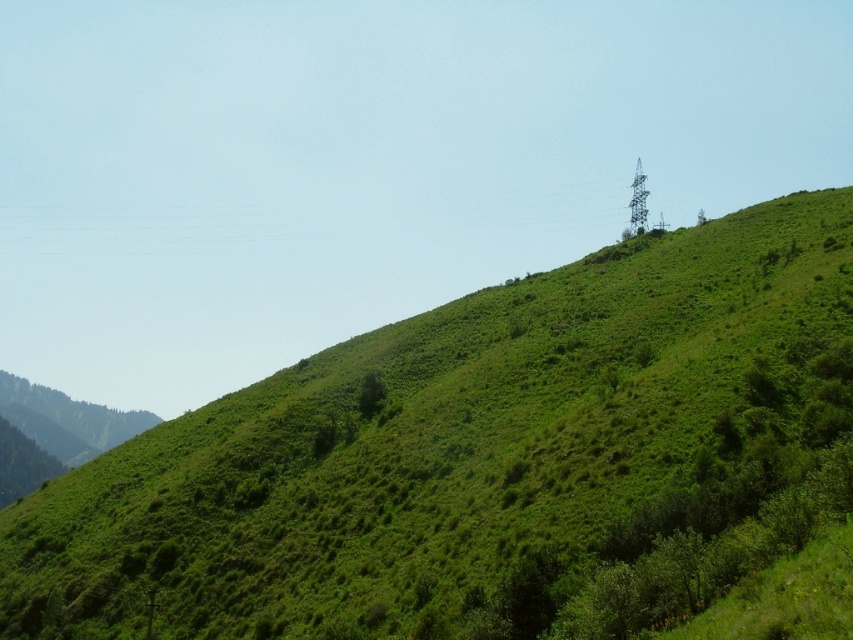
Looking at this image, between green leafy tree at lower left and green leafy tree at center, which one appears on the right side from the viewer's perspective?

Positioned to the right is green leafy tree at center.

Is green leafy tree at lower left to the right of green leafy tree at center from the viewer's perspective?

No, green leafy tree at lower left is not to the right of green leafy tree at center.

What do you see at coordinates (22, 464) in the screenshot? This screenshot has width=853, height=640. I see `green leafy tree at lower left` at bounding box center [22, 464].

Identify the location of green leafy tree at lower left. The width and height of the screenshot is (853, 640). (22, 464).

In the scene shown: Does green grassy hill at upper center have a lesser width compared to green leafy tree at center?

No, green grassy hill at upper center is not thinner than green leafy tree at center.

Is green grassy hill at upper center bigger than green leafy tree at center?

Yes.

Find the location of a particular element. green grassy hill at upper center is located at coordinates (465, 449).

The height and width of the screenshot is (640, 853). Identify the location of green grassy hill at upper center. (465, 449).

Who is positioned more to the right, green grassy hill at upper center or green leafy tree at lower left?

Positioned to the right is green grassy hill at upper center.

Is point (68, 618) farther from viewer compared to point (38, 477)?

No, (68, 618) is closer to viewer.

Is point (526, 493) positioned before point (28, 454)?

Yes, it is.

Image resolution: width=853 pixels, height=640 pixels. Find the location of `green grassy hill at upper center`. green grassy hill at upper center is located at coordinates (465, 449).